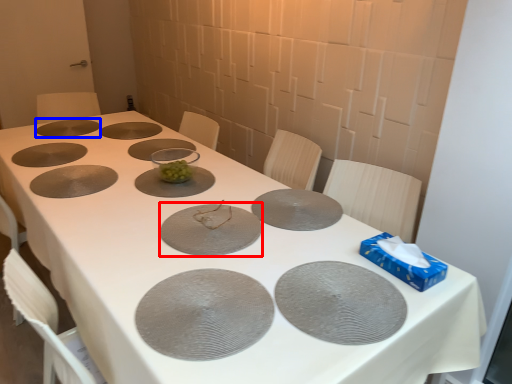
Question: Which object appears farthest to the camera in this image, glass plate (highlighted by a red box) or glass plate (highlighted by a blue box)?

Choices:
 (A) glass plate
 (B) glass plate

Answer: (B)